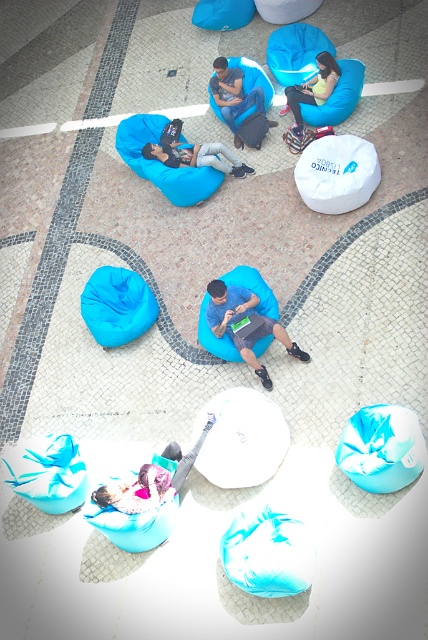
You are standing at the center of the scene and want to move towards the white circular table at the center. Which direction should you go from the point marked as point (234, 93)?

The point (234, 93) is where the matte blue bean bag at center is located. Since the white circular table is also at the center, you are already at the central area and do not need to move further.

You are standing in the room and want to move from the matte blue bean bag at upper left to the matte blue bean bag at lower center. Which direction should you move in?

You should move downward from the matte blue bean bag at upper left to the matte blue bean bag at lower center since the upper left bean bag is further forward and the lower center one is positioned behind it.

You are a person who is 1.8 meters tall and wants to sit on the blue fabric bean bag at center. However, you notice there is a matte blue bean bag at lower center nearby. How far apart are these two bean bags?

The blue fabric bean bag at center is 1.27 meters from matte blue bean bag at lower center, so they are 1.27 meters apart.